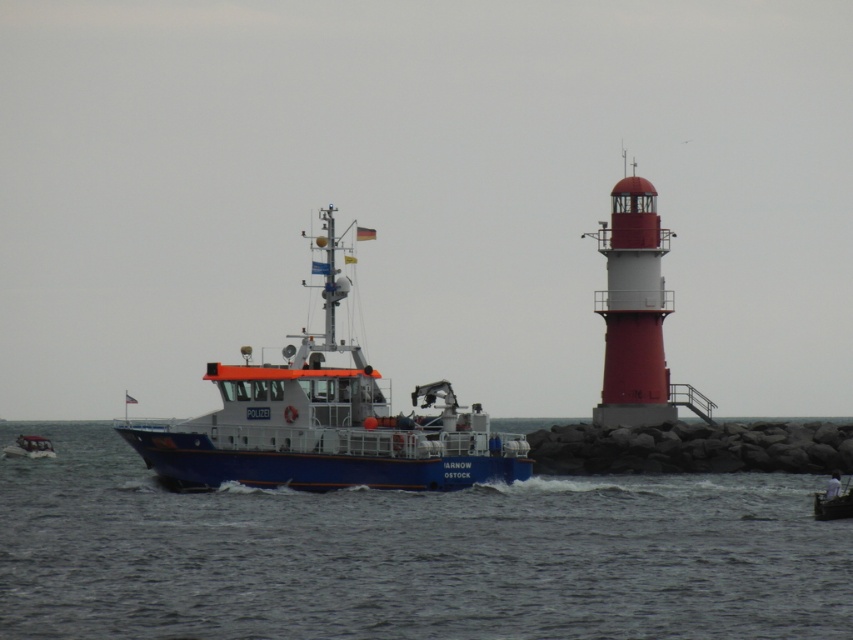
You are a photographer taking a picture of the police boat and lighthouse. You notice two points in the scene labeled as point (268,480) and point (831,515). Which point is closer to your camera?

Point (268,480) is further to the camera than point (831,515). Therefore, point (831,515) is closer to the camera.